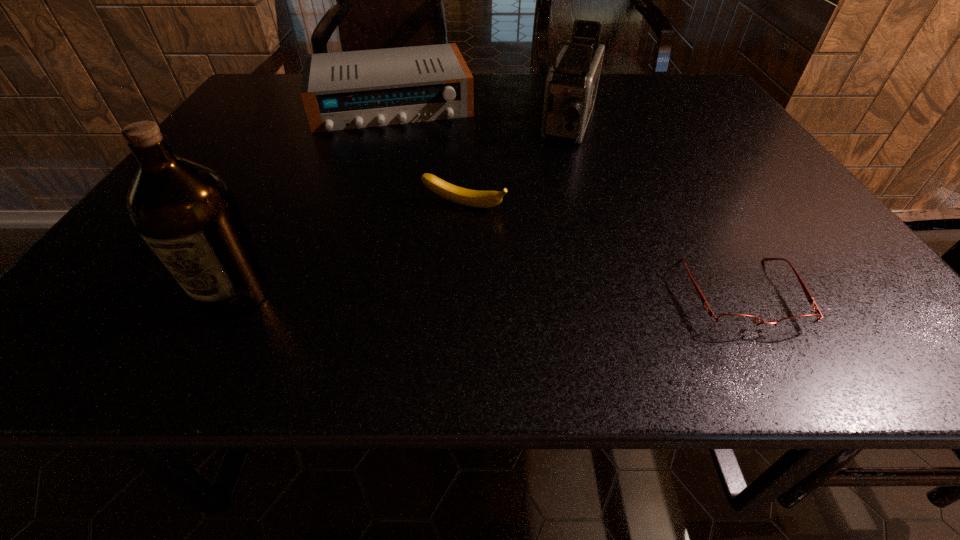
Where is `the third closest object to the shortest object`? This screenshot has height=540, width=960. the third closest object to the shortest object is located at coordinates (355, 89).